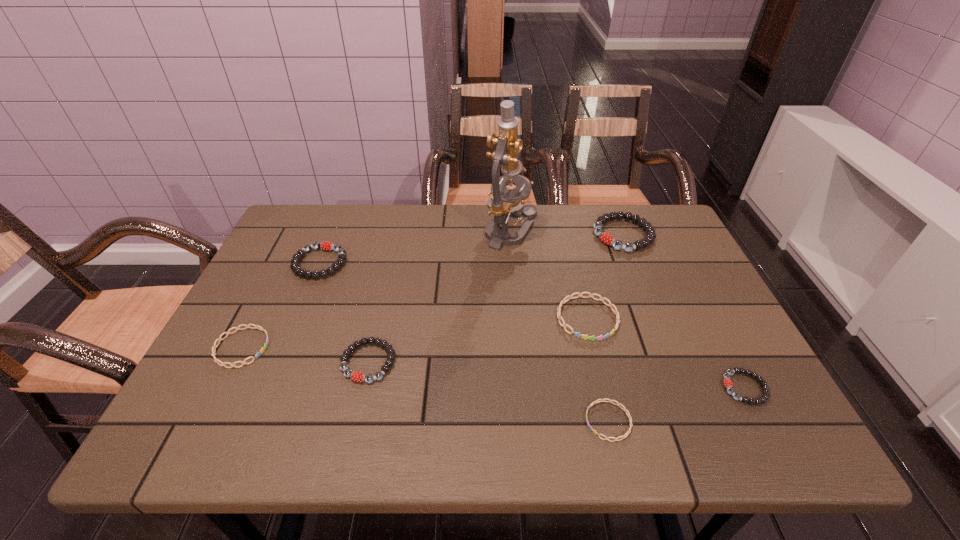
Locate an element on the screen. This screenshot has width=960, height=540. the fourth object from left to right is located at coordinates (504, 203).

You are a GUI agent. You are given a task and a screenshot of the screen. Output one action in this format:
    pyautogui.click(x=<x>, y=<y>)
    Task: Click on the tallest object
    This screenshot has height=540, width=960.
    Given the screenshot: What is the action you would take?
    pyautogui.click(x=504, y=203)

The image size is (960, 540). In order to click on the second tallest object in this screenshot , I will do `click(642, 222)`.

Where is `the tallest bracelet`? Image resolution: width=960 pixels, height=540 pixels. the tallest bracelet is located at coordinates (642, 222).

The width and height of the screenshot is (960, 540). Find the location of `the sixth shortest object`. the sixth shortest object is located at coordinates (325, 245).

You are a GUI agent. You are given a task and a screenshot of the screen. Output one action in this format:
    pyautogui.click(x=<x>, y=<y>)
    Task: Click on the third smallest black bracelet
    The width and height of the screenshot is (960, 540).
    Given the screenshot: What is the action you would take?
    pyautogui.click(x=325, y=245)

This screenshot has height=540, width=960. I want to click on the biggest blue bracelet, so point(569,297).

Where is `the third biggest black bracelet`? the third biggest black bracelet is located at coordinates (356, 376).

The image size is (960, 540). Identify the location of the sixth object from right to left. (356, 376).

Where is `the leftmost blue bracelet`? the leftmost blue bracelet is located at coordinates (219, 339).